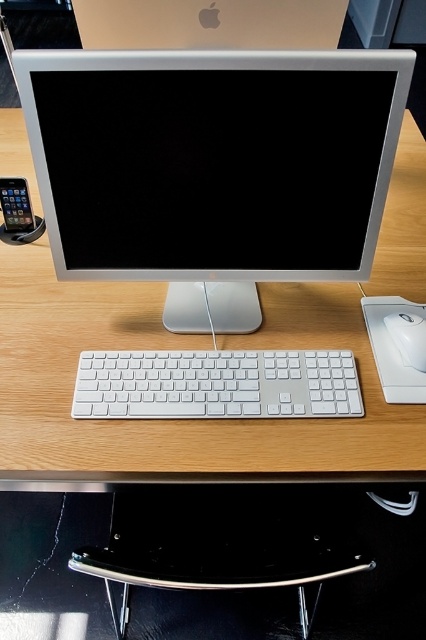
Which of these two, white plastic keyboard at center or satin black smartphone at left, stands taller?

With more height is satin black smartphone at left.

Is white plastic keyboard at center smaller than satin black smartphone at left?

No.

Where is `white plastic keyboard at center`? white plastic keyboard at center is located at coordinates [216, 385].

Find the location of `white plastic keyboard at center`. white plastic keyboard at center is located at coordinates (216, 385).

Who is positioned more to the right, wooden desk at center or white plastic mouse at lower right?

Positioned to the right is white plastic mouse at lower right.

Is point (86, 474) positioned before point (397, 316)?

That is True.

I want to click on wooden desk at center, so click(x=175, y=420).

Between sleek silver monitor at center and white plastic mouse at lower right, which one appears on the right side from the viewer's perspective?

From the viewer's perspective, white plastic mouse at lower right appears more on the right side.

Does sleek silver monitor at center have a lesser width compared to white plastic mouse at lower right?

Incorrect, sleek silver monitor at center's width is not less than white plastic mouse at lower right's.

You are a GUI agent. You are given a task and a screenshot of the screen. Output one action in this format:
    pyautogui.click(x=<x>, y=<y>)
    Task: Click on the sleek silver monitor at center
    The width and height of the screenshot is (426, 640).
    Given the screenshot: What is the action you would take?
    [x=213, y=161]

This screenshot has width=426, height=640. Identify the location of sleek silver monitor at center. (213, 161).